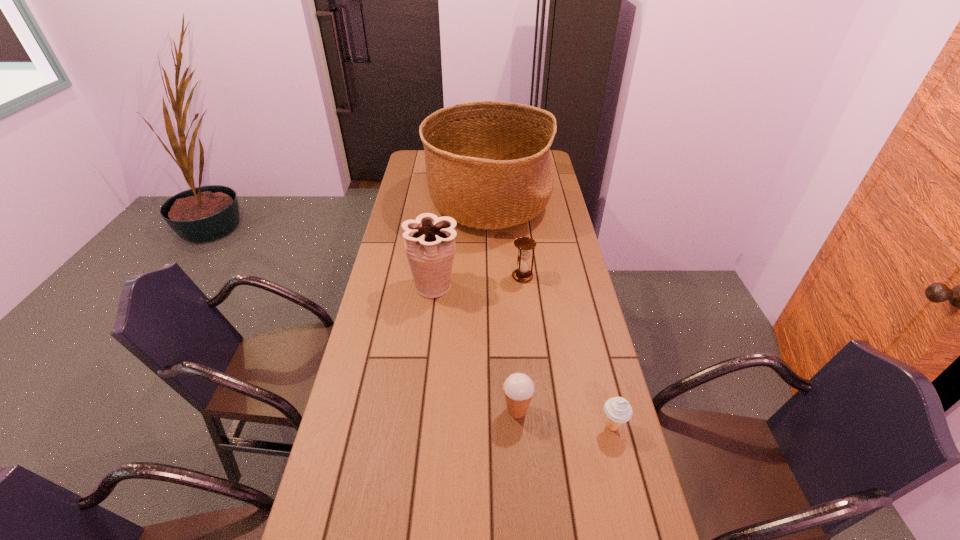
Locate an element on the screen. This screenshot has height=540, width=960. vacant space in between the right icecream and the left icecream is located at coordinates pyautogui.click(x=564, y=418).

Where is `vacant space that is in between the fourth shortest object and the tallest object`? The image size is (960, 540). vacant space that is in between the fourth shortest object and the tallest object is located at coordinates (461, 245).

Locate an element on the screen. The width and height of the screenshot is (960, 540). vacant area that lies between the tallest object and the left icecream is located at coordinates (502, 307).

Locate an element on the screen. This screenshot has width=960, height=540. free spot between the urn and the farthest object is located at coordinates (461, 245).

The height and width of the screenshot is (540, 960). I want to click on vacant space in between the farthest object and the urn, so click(x=461, y=245).

You are a GUI agent. You are given a task and a screenshot of the screen. Output one action in this format:
    pyautogui.click(x=<x>, y=<y>)
    Task: Click on the free space between the fourth shortest object and the right icecream
    This screenshot has height=540, width=960.
    Given the screenshot: What is the action you would take?
    pyautogui.click(x=523, y=356)

I want to click on vacant area that lies between the left icecream and the fourth shortest object, so click(475, 348).

At what (x,y) coordinates should I click in order to perform the action: click on free spot between the left icecream and the second tallest object. Please return your answer as a coordinate pair (x, y). This screenshot has height=540, width=960. Looking at the image, I should click on (475, 348).

Where is `object that stands as the third closest to the left icecream`? The height and width of the screenshot is (540, 960). object that stands as the third closest to the left icecream is located at coordinates (524, 244).

Where is `object that is the nearest to the right icecream`? object that is the nearest to the right icecream is located at coordinates (518, 388).